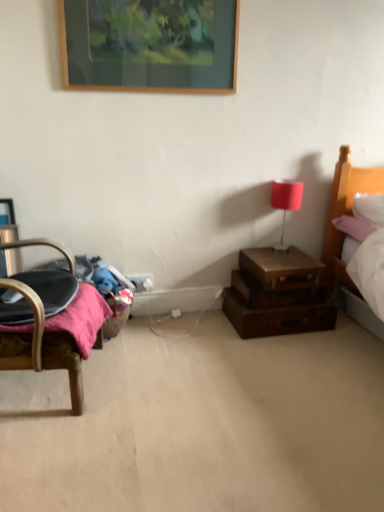
Question: From the image's perspective, is matte red table lamp at upper right located above brown leather suitcase at lower right?

Choices:
 (A) no
 (B) yes

Answer: (B)

Question: From a real-world perspective, is matte red table lamp at upper right located higher than brown leather suitcase at lower right?

Choices:
 (A) no
 (B) yes

Answer: (B)

Question: Considering the relative positions of matte red table lamp at upper right and brown leather suitcase at lower right in the image provided, is matte red table lamp at upper right to the left of brown leather suitcase at lower right from the viewer's perspective?

Choices:
 (A) no
 (B) yes

Answer: (A)

Question: Is matte red table lamp at upper right oriented towards brown leather suitcase at lower right?

Choices:
 (A) no
 (B) yes

Answer: (A)

Question: From the image's perspective, would you say matte red table lamp at upper right is shown under brown leather suitcase at lower right?

Choices:
 (A) yes
 (B) no

Answer: (B)

Question: Is brown leather suitcase at lower right bigger or smaller than white plastic electric outlet at lower center?

Choices:
 (A) big
 (B) small

Answer: (A)

Question: From the image's perspective, relative to white plastic electric outlet at lower center, is brown leather suitcase at lower right above or below?

Choices:
 (A) above
 (B) below

Answer: (B)

Question: Is point (251, 292) positioned closer to the camera than point (137, 282)?

Choices:
 (A) closer
 (B) farther

Answer: (A)

Question: In the image, is brown leather suitcase at lower right positioned in front of or behind white plastic electric outlet at lower center?

Choices:
 (A) front
 (B) behind

Answer: (A)

Question: Is point (137, 280) positioned closer to the camera than point (319, 313)?

Choices:
 (A) closer
 (B) farther

Answer: (B)

Question: Is white plastic electric outlet at lower center to the left or to the right of brown wooden drawers at lower right in the image?

Choices:
 (A) right
 (B) left

Answer: (B)

Question: Is white plastic electric outlet at lower center in front of or behind brown wooden drawers at lower right in the image?

Choices:
 (A) front
 (B) behind

Answer: (B)

Question: Looking at the image, does white plastic electric outlet at lower center seem bigger or smaller compared to brown wooden drawers at lower right?

Choices:
 (A) small
 (B) big

Answer: (A)

Question: In terms of height, does brown leather suitcase at right look taller or shorter compared to matte red table lamp at upper right?

Choices:
 (A) short
 (B) tall

Answer: (A)

Question: Is brown leather suitcase at right wider or thinner than matte red table lamp at upper right?

Choices:
 (A) thin
 (B) wide

Answer: (B)